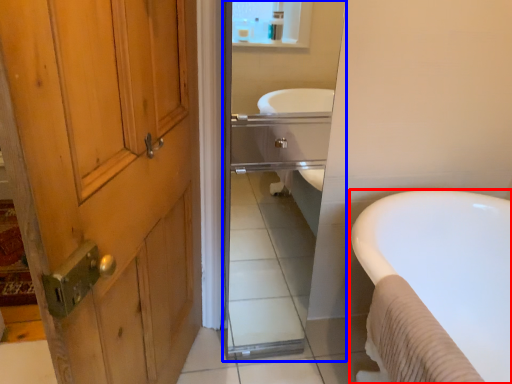
Question: Which point is closer to the camera, bathtub (highlighted by a red box) or mirror (highlighted by a blue box)?

Choices:
 (A) bathtub
 (B) mirror

Answer: (A)